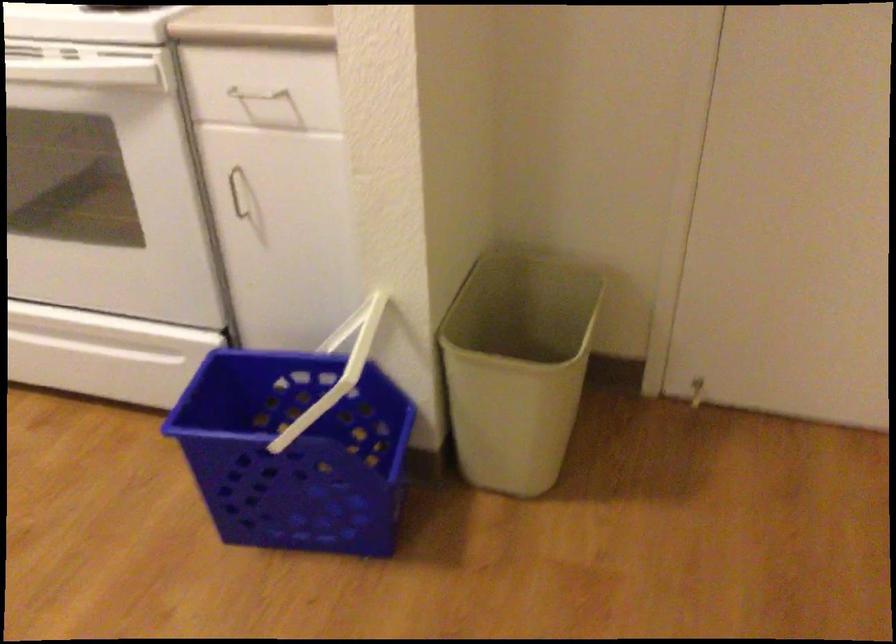
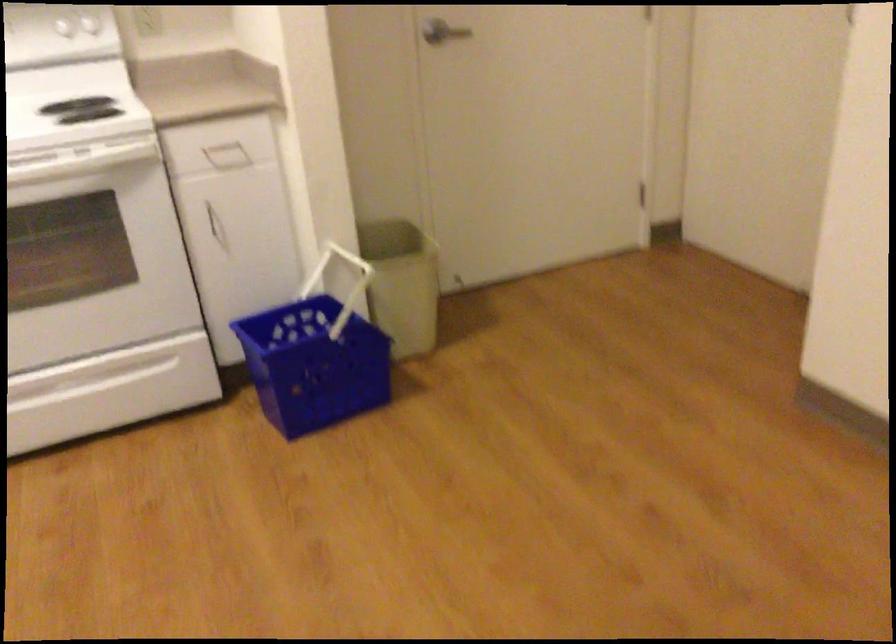
Where in the second image is the point corresponding to pixel 272 118 from the first image?

(227, 156)